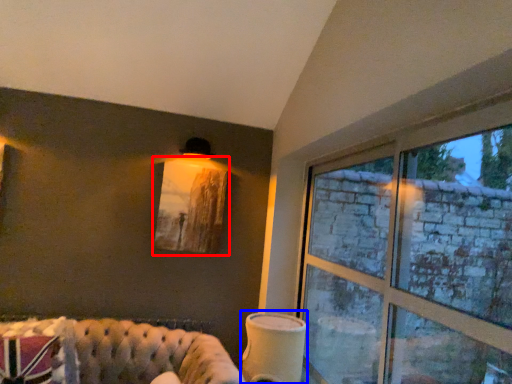
Question: Among these objects, which one is farthest to the camera, picture frame (highlighted by a red box) or table lamp (highlighted by a blue box)?

Choices:
 (A) picture frame
 (B) table lamp

Answer: (A)